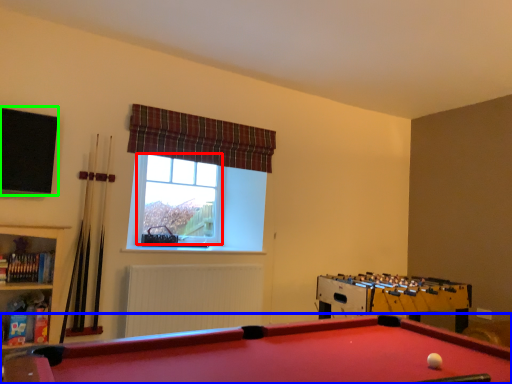
Question: Which is nearer to the bay window (highlighted by a red box)? billiard table (highlighted by a blue box) or window screen (highlighted by a green box).

Choices:
 (A) billiard table
 (B) window screen

Answer: (B)